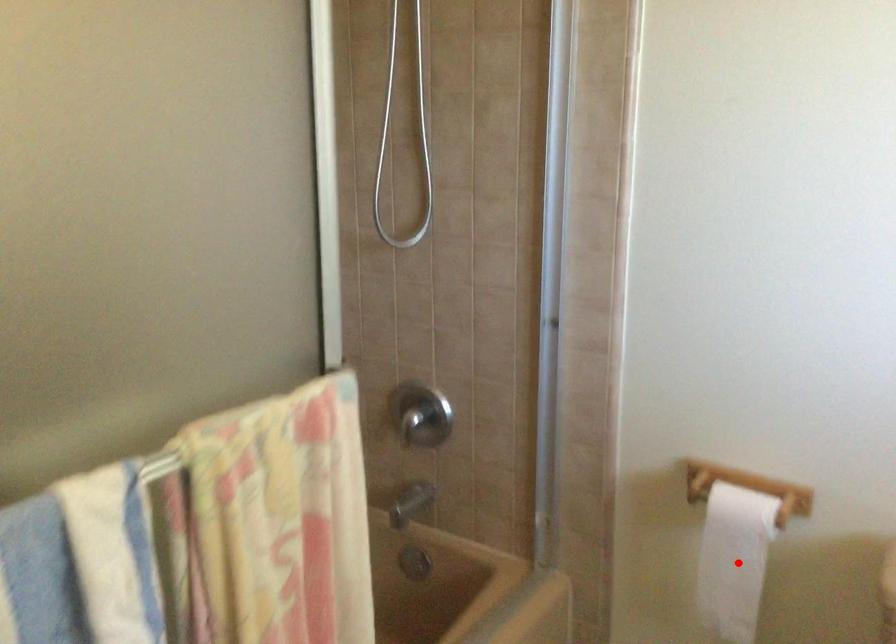
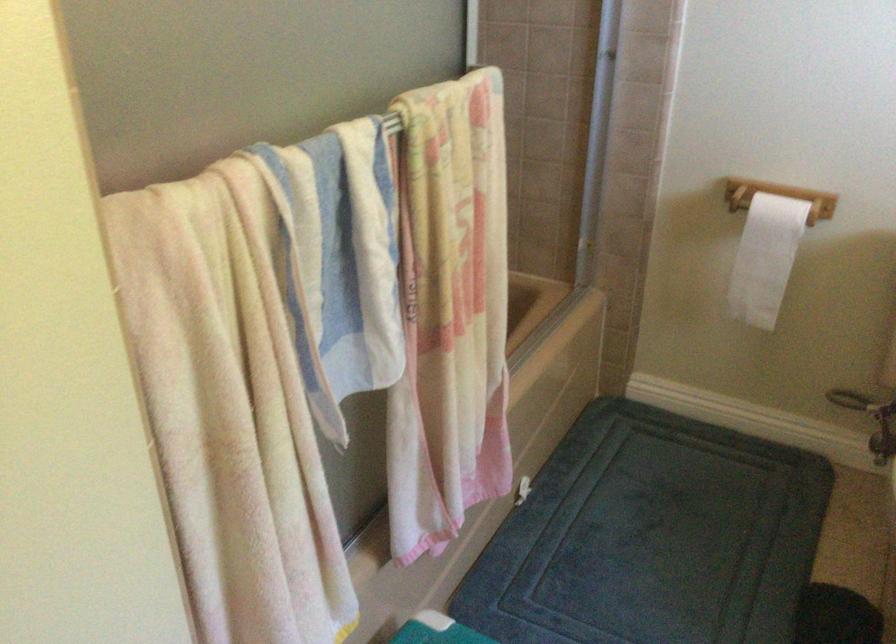
Question: I am providing you with two images of the same scene from different viewpoints. Image1 has a red point marked. In image2, the corresponding 3D location appears at what relative position? Reply with the corresponding letter.

Choices:
 (A) Closer
 (B) Farther

Answer: (B)